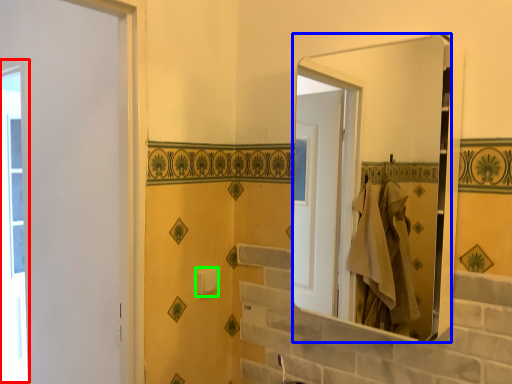
Question: Which object is positioned closest to window (highlighted by a red box)? Select from mirror (highlighted by a blue box) and towel bar (highlighted by a green box).

Choices:
 (A) mirror
 (B) towel bar

Answer: (B)